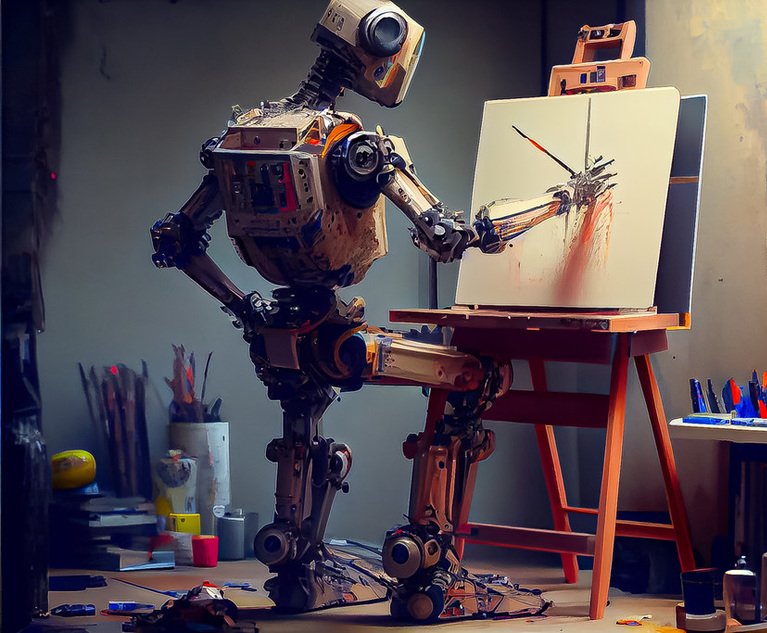
Identify the location of wooden tabletop. The image size is (767, 633). (583, 318).